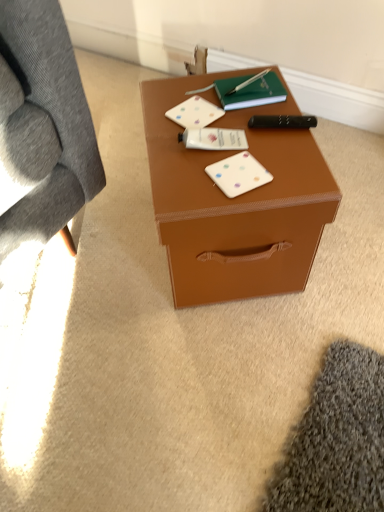
You are a GUI agent. You are given a task and a screenshot of the screen. Output one action in this format:
    pyautogui.click(x=<x>, y=<y>)
    Task: Click on the free spot to the left of green matte notebook at upper center
    This screenshot has width=384, height=512.
    Given the screenshot: What is the action you would take?
    pyautogui.click(x=177, y=102)